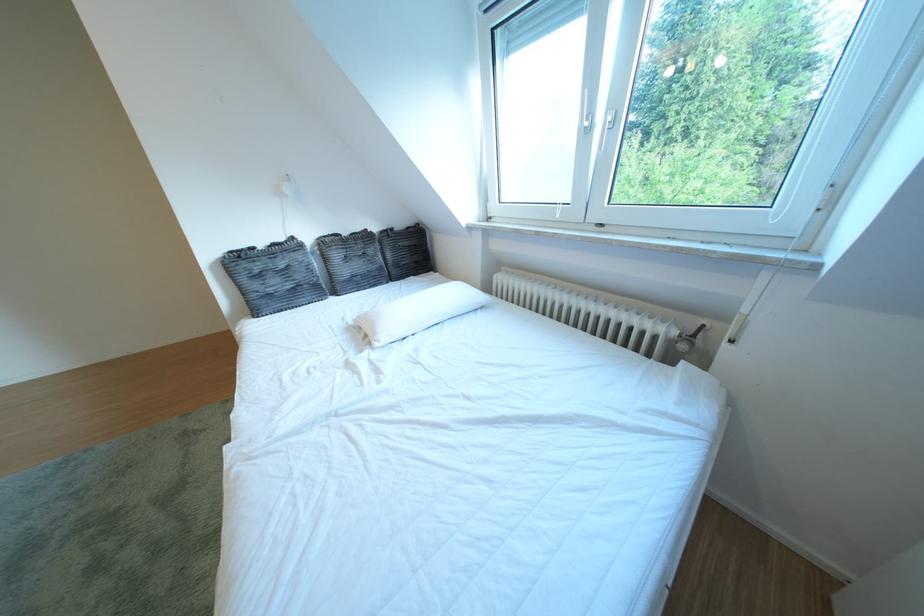
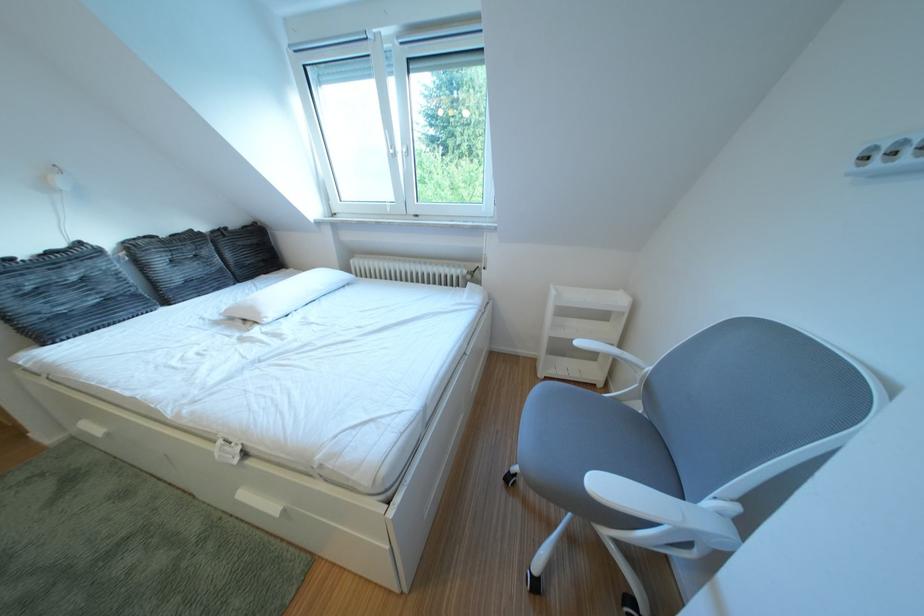
Where in the second image is the point corresponding to pixel 307 243 from the first image?

(93, 249)